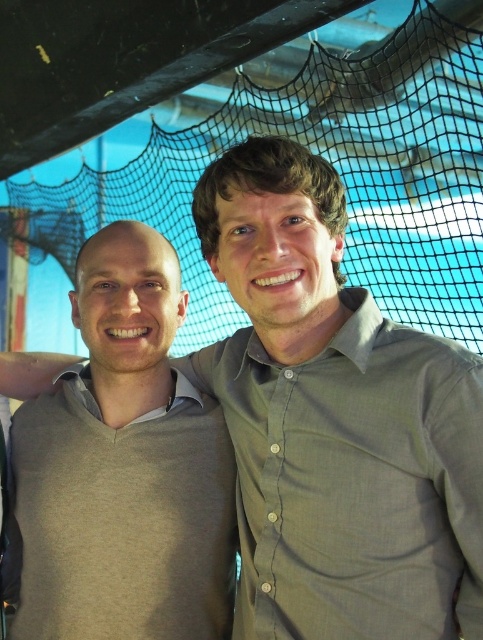
Consider the image. You are a photographer trying to capture a candid shot of the two people in the scene. You want to ensure that the light gray sweater at center and the black mesh net at upper center are both visible in the frame. Based on their positions, which object is closer to the left edge of the photo?

The light gray sweater at center is positioned on the left side of the black mesh net at upper center, so it is closer to the left edge of the photo.

You are a photographer setting up for a portrait session in this outdoor area. You want to ensure the light gray sweater at center is visible against the background. Since the black mesh net at upper center is in the scene, where should you position the lighting to highlight the sweater?

The light gray sweater at center is positioned under the black mesh net at upper center. To highlight the sweater, position the lighting above the black mesh net at upper center so that it casts downward light onto the sweater, ensuring it stands out against the background.